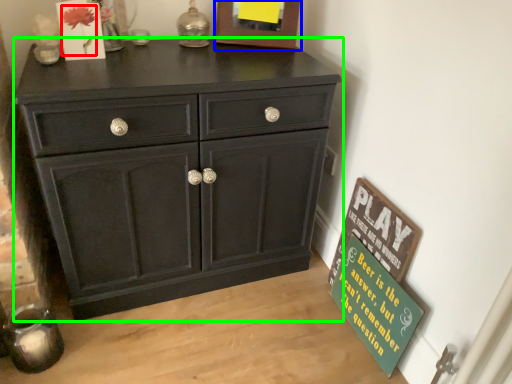
Question: Which object is positioned closest to flower (highlighted by a red box)? Select from picture frame (highlighted by a blue box) and chest of drawers (highlighted by a green box).

Choices:
 (A) picture frame
 (B) chest of drawers

Answer: (A)